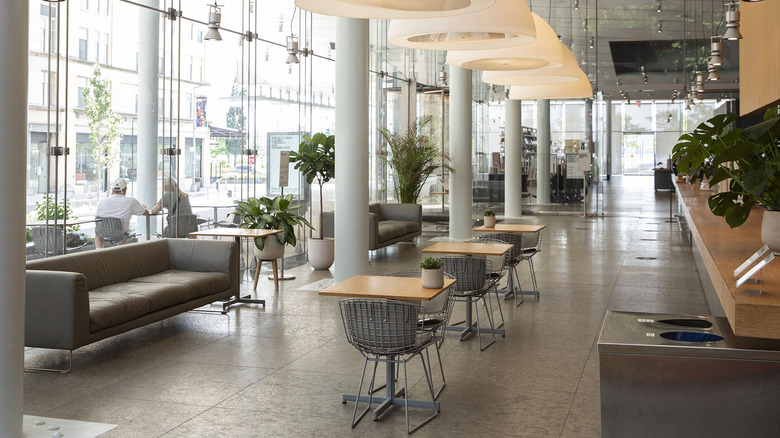
What are the coordinates of `interior column` in the screenshot? It's located at (353, 94), (459, 138), (544, 137), (509, 147), (587, 118).